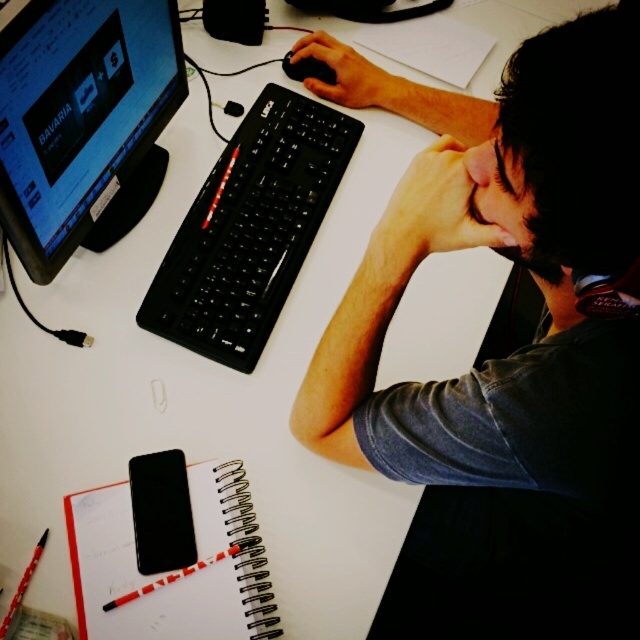
Question: Can you confirm if skinny red pen at upper center is bigger than black matte mouse at center?

Choices:
 (A) no
 (B) yes

Answer: (B)

Question: Can you confirm if black plastic keyboard at center is positioned to the left of red striped pen at lower left?

Choices:
 (A) yes
 (B) no

Answer: (B)

Question: Which point is closer to the camera taking this photo?

Choices:
 (A) (518, 65)
 (B) (381, 76)
 (C) (77, 572)

Answer: (A)

Question: Is black plastic keyboard at center above spiral-bound notebook at lower left?

Choices:
 (A) no
 (B) yes

Answer: (B)

Question: Which point is farther to the camera?

Choices:
 (A) black glossy monitor at upper left
 (B) black matte mouse at center

Answer: (B)

Question: Among these points, which one is nearest to the camera?

Choices:
 (A) 344,90
 (B) 326,72
 (C) 140,586

Answer: (C)